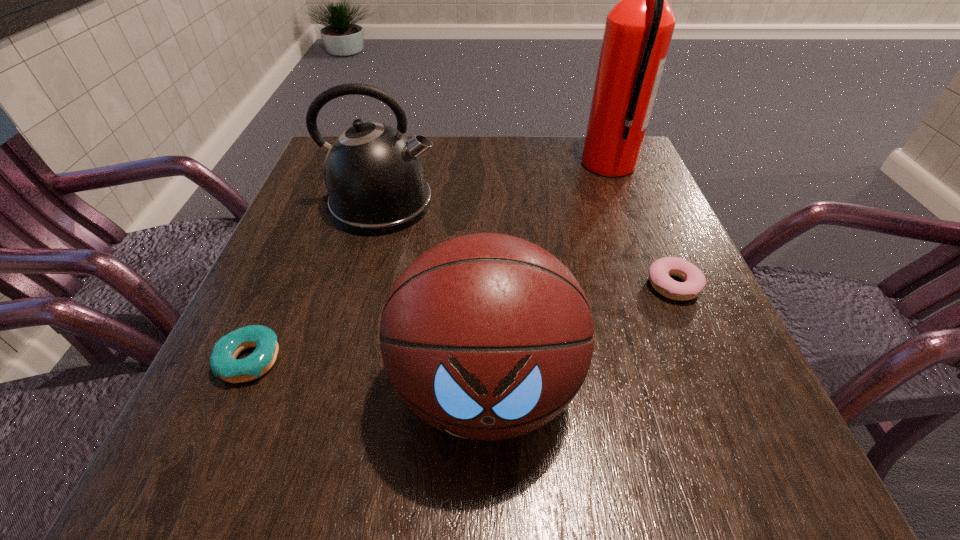
Where is `vacant point located on the back of the basketball`? vacant point located on the back of the basketball is located at coordinates (484, 193).

The width and height of the screenshot is (960, 540). I want to click on free location located on the front of the third nearest object, so click(x=724, y=403).

What are the coordinates of `free space located 0.370m on the back of the nearer doughnut` in the screenshot? It's located at (321, 198).

Locate an element on the screen. The image size is (960, 540). fire extinguisher that is positioned at the far edge is located at coordinates (638, 31).

The width and height of the screenshot is (960, 540). Find the location of `kettle present at the far edge`. kettle present at the far edge is located at coordinates (375, 177).

You are a GUI agent. You are given a task and a screenshot of the screen. Output one action in this format:
    pyautogui.click(x=<x>, y=<y>)
    Task: Click on the object that is at the near edge
    
    Given the screenshot: What is the action you would take?
    pyautogui.click(x=486, y=336)

The width and height of the screenshot is (960, 540). Identify the location of kettle that is at the left edge. (375, 177).

Find the location of `doughnut located in the left edge section of the desktop`. doughnut located in the left edge section of the desktop is located at coordinates (223, 362).

Image resolution: width=960 pixels, height=540 pixels. What are the coordinates of `fire extinguisher situated at the right edge` in the screenshot? It's located at point(638,31).

Locate an element on the screen. This screenshot has width=960, height=540. doughnut at the right edge is located at coordinates (660, 271).